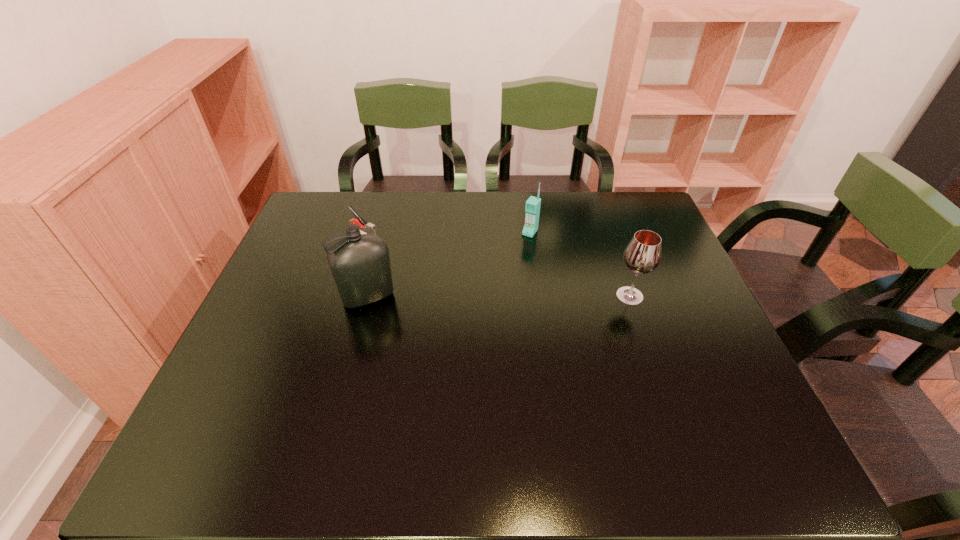
Locate an element on the screen. The width and height of the screenshot is (960, 540). the tallest object is located at coordinates (360, 264).

This screenshot has height=540, width=960. What are the coordinates of `the rightmost object` in the screenshot? It's located at (642, 255).

Find the location of `the second object from right to left`. the second object from right to left is located at coordinates (532, 207).

The width and height of the screenshot is (960, 540). Find the location of `stapler`. stapler is located at coordinates (370, 228).

What are the coordinates of `vacant space located on the back of the bottle` in the screenshot? It's located at (384, 236).

The width and height of the screenshot is (960, 540). I want to click on vacant area situated on the back of the rightmost object, so click(x=613, y=249).

At what (x,y) coordinates should I click in order to perform the action: click on vacant space positioned 0.100m on the keypad of the second object from right to left. Please return your answer as a coordinate pair (x, y). Image resolution: width=960 pixels, height=540 pixels. Looking at the image, I should click on (513, 256).

Locate an element on the screen. Image resolution: width=960 pixels, height=540 pixels. free spot located 0.110m on the keypad of the second object from right to left is located at coordinates (512, 258).

Identify the location of vacant position located on the keypad of the second object from right to left. The height and width of the screenshot is (540, 960). (489, 289).

I want to click on free space located on the handle side of the shortest object, so click(394, 247).